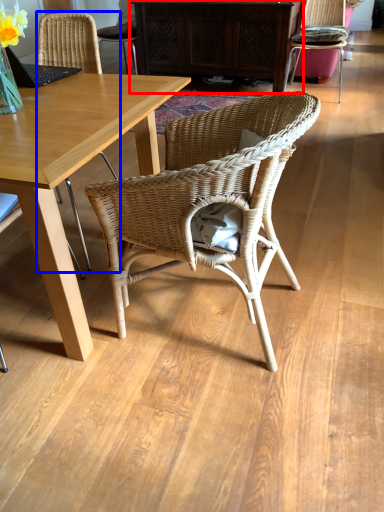
Question: Among these objects, which one is nearest to the camera, cabinetry (highlighted by a red box) or chair (highlighted by a blue box)?

Choices:
 (A) cabinetry
 (B) chair

Answer: (B)